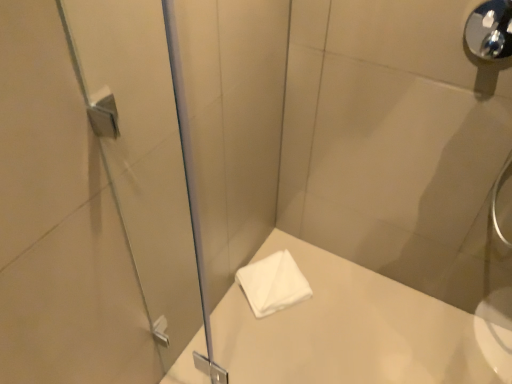
I want to click on transparent glass screen door at left, so click(x=141, y=153).

Where is `polished chrome shower handle at upper right`? polished chrome shower handle at upper right is located at coordinates (490, 30).

Consider the image. Is white soft towel at center not inside transparent glass screen door at left?

That's correct, white soft towel at center is outside of transparent glass screen door at left.

Based on the photo, which is more distant, (241, 275) or (151, 216)?

The point (241, 275) is farther from the camera.

Can you confirm if white soft towel at center is smaller than transparent glass screen door at left?

Yes.

In the scene shown: How much distance is there between white soft towel at center and transparent glass screen door at left?

white soft towel at center and transparent glass screen door at left are 21.34 inches apart from each other.

From the image's perspective, is transparent glass screen door at left on top of white soft towel at center?

Correct, transparent glass screen door at left appears higher than white soft towel at center in the image.

Which object is closer to the camera taking this photo, transparent glass screen door at left or white soft towel at center?

transparent glass screen door at left is in front.

Is transparent glass screen door at left inside the boundaries of white soft towel at center, or outside?

transparent glass screen door at left is not inside white soft towel at center, it's outside.

Does polished chrome shower handle at upper right have a lesser height compared to white soft towel at center?

No, polished chrome shower handle at upper right is not shorter than white soft towel at center.

In the scene shown: From a real-world perspective, which object stands above the other?

polished chrome shower handle at upper right is physically above.

What's the angular difference between polished chrome shower handle at upper right and white soft towel at center's facing directions?

55.8 degrees.

Is polished chrome shower handle at upper right completely or partially outside of white soft towel at center?

Yes, polished chrome shower handle at upper right is not within white soft towel at center.

From the image's perspective, which object appears higher, white soft towel at center or polished chrome shower handle at upper right?

polished chrome shower handle at upper right is shown above in the image.

Is white soft towel at center in front of or behind polished chrome shower handle at upper right in the image?

In the image, white soft towel at center appears behind polished chrome shower handle at upper right.

Is there a large distance between white soft towel at center and polished chrome shower handle at upper right?

Absolutely, white soft towel at center is distant from polished chrome shower handle at upper right.

Between white soft towel at center and polished chrome shower handle at upper right, which one has less height?

white soft towel at center.

Is point (489, 8) closer or farther from the camera than point (151, 197)?

Clearly, point (489, 8) is more distant from the camera than point (151, 197).

Between polished chrome shower handle at upper right and transparent glass screen door at left, which one is positioned behind?

polished chrome shower handle at upper right is further away from the camera.

You are a GUI agent. You are given a task and a screenshot of the screen. Output one action in this format:
    pyautogui.click(x=<x>, y=<y>)
    Task: Click on the shower above the transparent glass screen door at left (from the image's perspective)
    This screenshot has width=512, height=384.
    Given the screenshot: What is the action you would take?
    [x=490, y=30]

Between polished chrome shower handle at upper right and transparent glass screen door at left, which one has more height?

Standing taller between the two is transparent glass screen door at left.

Considering the sizes of objects transparent glass screen door at left and polished chrome shower handle at upper right in the image provided, who is wider, transparent glass screen door at left or polished chrome shower handle at upper right?

transparent glass screen door at left.

Is transparent glass screen door at left looking in the opposite direction of polished chrome shower handle at upper right?

No, polished chrome shower handle at upper right is not at the back of transparent glass screen door at left.

From a real-world perspective, between transparent glass screen door at left and polished chrome shower handle at upper right, who is vertically higher?

polished chrome shower handle at upper right, from a real-world perspective.

Can polished chrome shower handle at upper right be found inside transparent glass screen door at left?

Actually, polished chrome shower handle at upper right is outside transparent glass screen door at left.

This screenshot has height=384, width=512. In order to click on screen door lying above the white soft towel at center (from the image's perspective) in this screenshot , I will do `click(141, 153)`.

Identify the location of towel behind the transparent glass screen door at left. The height and width of the screenshot is (384, 512). (273, 283).

Looking at the image, which one is located further to white soft towel at center, transparent glass screen door at left or polished chrome shower handle at upper right?

The object further to white soft towel at center is polished chrome shower handle at upper right.

In the scene shown: Estimate the real-world distances between objects in this image. Which object is closer to polished chrome shower handle at upper right, white soft towel at center or transparent glass screen door at left?

transparent glass screen door at left lies closer to polished chrome shower handle at upper right than the other object.

Based on their spatial positions, is polished chrome shower handle at upper right or white soft towel at center further from transparent glass screen door at left?

Among the two, polished chrome shower handle at upper right is located further to transparent glass screen door at left.

Considering their positions, is polished chrome shower handle at upper right positioned further to white soft towel at center than transparent glass screen door at left?

polished chrome shower handle at upper right.

When comparing their distances from polished chrome shower handle at upper right, does transparent glass screen door at left or white soft towel at center seem further?

white soft towel at center is positioned further to the anchor polished chrome shower handle at upper right.

From the image, which object appears to be farther from transparent glass screen door at left, white soft towel at center or polished chrome shower handle at upper right?

polished chrome shower handle at upper right is further to transparent glass screen door at left.

What are the coordinates of `shower positioned between transparent glass screen door at left and white soft towel at center from near to far` in the screenshot? It's located at (490, 30).